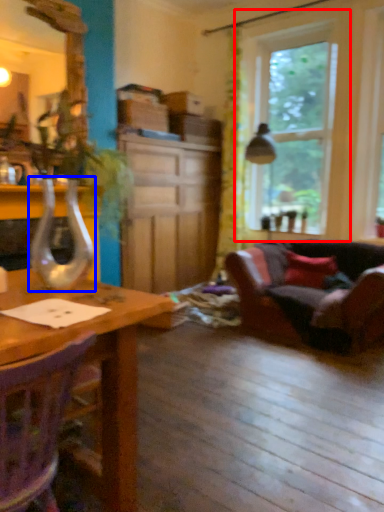
Question: Which point is further to the camera, window (highlighted by a red box) or glass vase (highlighted by a blue box)?

Choices:
 (A) window
 (B) glass vase

Answer: (A)